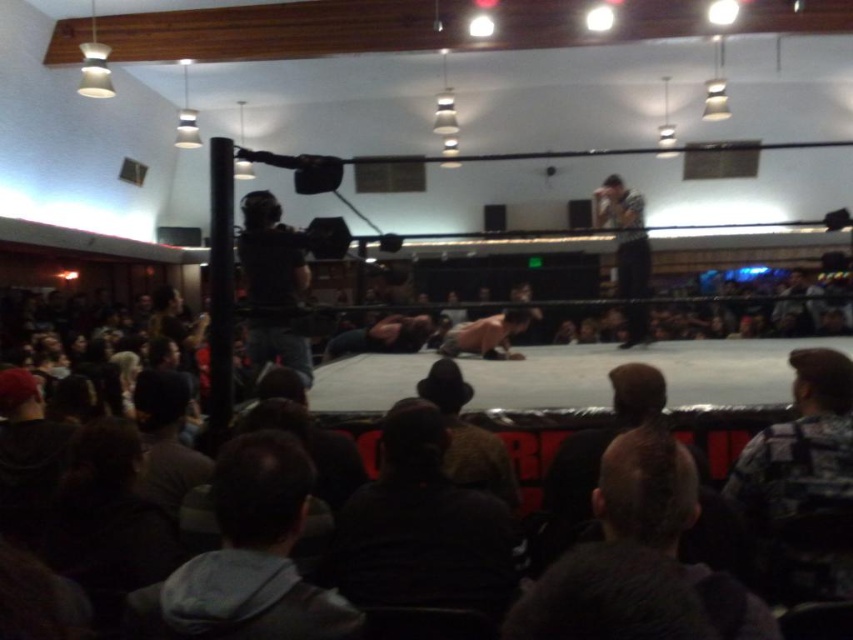
You are a photographer positioned at the center of the wrestling ring. You want to take a photo of the dark brown hair at center. Where should you aim your camera to capture it accurately?

The dark brown hair at center is located at the 2D coordinates point (x=646, y=490), so you should aim your camera at that specific coordinate to capture it accurately.

Based on the provided scene description, what are the coordinates of the smooth skin man at center in the wrestling ring?

The smooth skin man at center is located at coordinates point (381, 337).